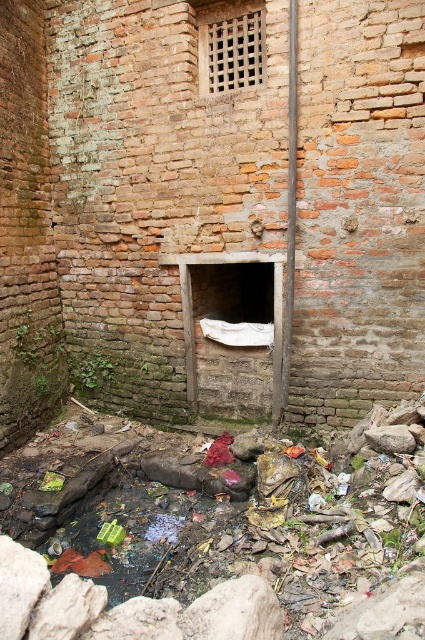
You are an inspector assessing the structural integrity of the brick structure. You notice the stone lattice window at center and the smooth metallic pole at center. Which object is closer to you, the inspector?

The stone lattice window at center is closer to you because the smooth metallic pole at center is behind it.

You are a delivery person trying to deliver a package to the building. You see a white paper at center and a stone lattice window at center. Which object is wider so that you can choose the best path to deliver the package?

The white paper at center might be wider than stone lattice window at center, so you should choose the white paper at center as the wider path for delivering the package.

You are standing in front of the dilapidated brick structure and notice two points marked on the wall. Which point is closer to you, point [155,90] or point [249,38]?

Point [249,38] is closer to you because point [155,90] is further away from the camera than point [249,38].